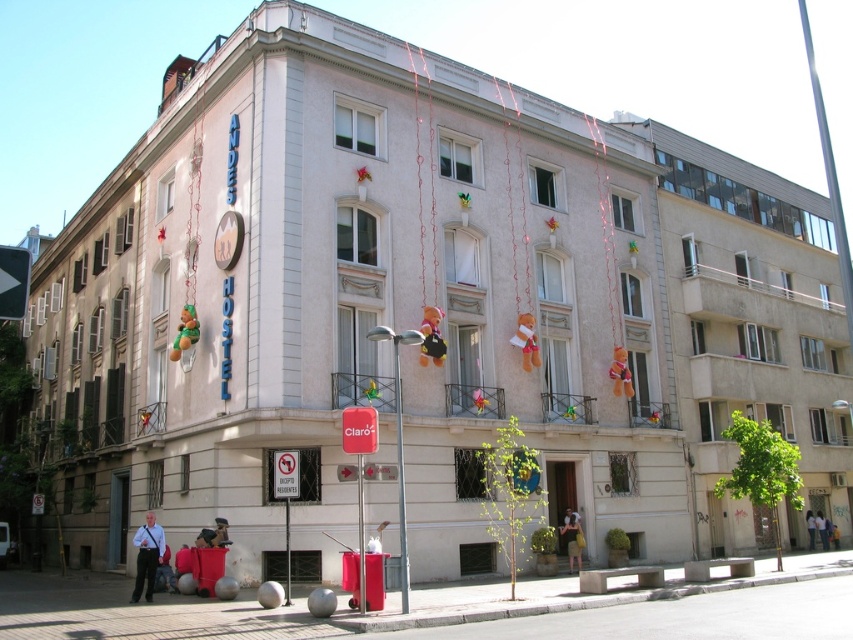
Question: Is light blue shirt at lower left behind white plastic sign at lower center?

Choices:
 (A) yes
 (B) no

Answer: (A)

Question: Is pink fabric streamers at center to the left of light brown leather backpack at lower center from the viewer's perspective?

Choices:
 (A) no
 (B) yes

Answer: (B)

Question: Estimate the real-world distances between objects in this image. Which object is closer to the light blue shirt at lower left?

Choices:
 (A) light blue jeans at lower center
 (B) white plastic sign at lower center
 (C) brushed metal pole at center

Answer: (B)

Question: Is pink fabric streamers at center to the left of light blue shirt at lower left from the viewer's perspective?

Choices:
 (A) yes
 (B) no

Answer: (B)

Question: Based on their relative distances, which object is nearer to the light brown leather backpack at lower center?

Choices:
 (A) white plastic sign at lower center
 (B) light brown leather jacket at center

Answer: (A)

Question: Which is nearer to the light brown leather backpack at lower center?

Choices:
 (A) white plastic sign at lower center
 (B) brushed metal pole at center

Answer: (B)